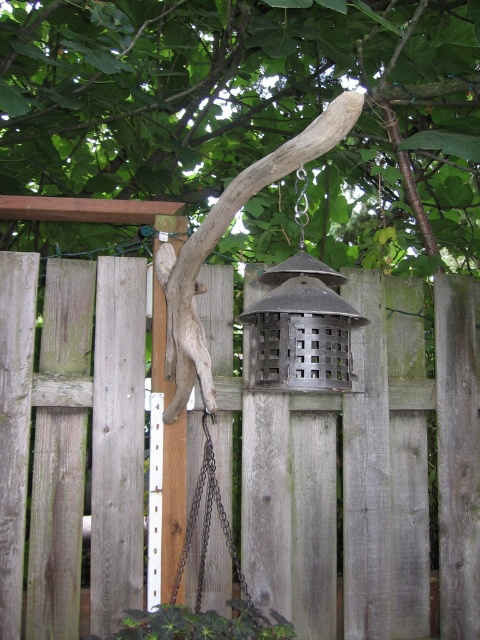
You are a bird trying to reach the bird feeder hanging from the curved branch. You see the weathered wood fence at center and the black metal chain at center. Which object is closer to the left side of the image?

The black metal chain at center is closer to the left side because the weathered wood fence at center is positioned on the right side of it.

You are a bird trying to land on the brown rough wood branch at center and the black metal chain at center. Which one is higher?

The brown rough wood branch at center is above the black metal chain at center, so it is higher.